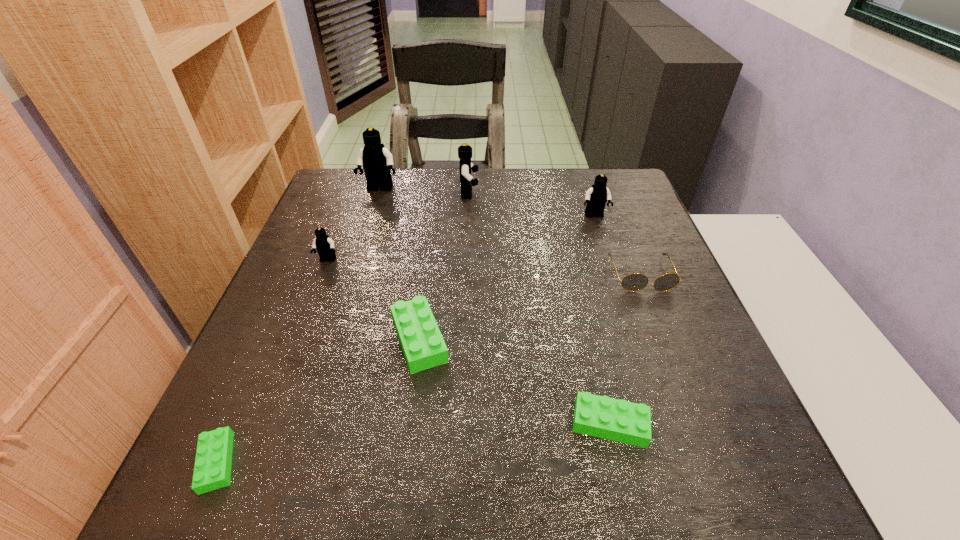
I want to click on the tallest object, so click(x=377, y=161).

This screenshot has width=960, height=540. Identify the location of the biggest black Lego. (377, 161).

This screenshot has width=960, height=540. I want to click on the third black Lego from left to right, so click(464, 151).

In order to click on the sixth shortest Lego in this screenshot , I will do `click(464, 151)`.

The width and height of the screenshot is (960, 540). Find the location of `the rightmost black Lego`. the rightmost black Lego is located at coordinates (596, 197).

Where is `the third farthest object`? the third farthest object is located at coordinates (596, 197).

The height and width of the screenshot is (540, 960). Find the location of `the fourth tallest object`. the fourth tallest object is located at coordinates (324, 245).

Identify the location of the fourth shortest Lego. (324, 245).

Find the location of a particular element. The width and height of the screenshot is (960, 540). sunglasses is located at coordinates (634, 282).

The image size is (960, 540). What are the coordinates of `the fifth farthest Lego` in the screenshot? It's located at (423, 346).